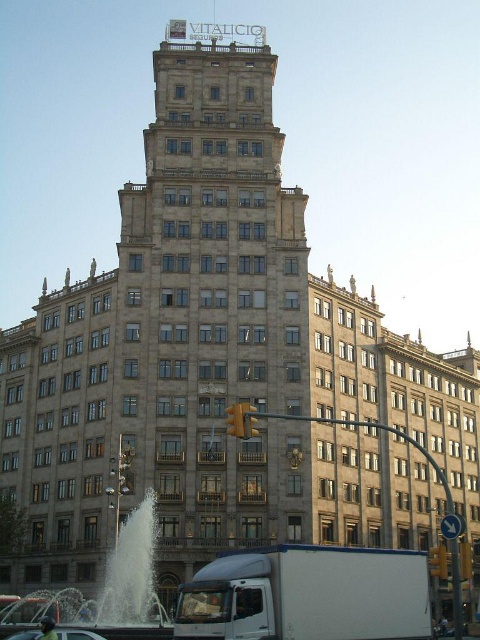
Question: Among these points, which one is nearest to the camera?

Choices:
 (A) (70, 636)
 (B) (160, 616)

Answer: (A)

Question: Which point is farther to the camera?

Choices:
 (A) (34, 637)
 (B) (128, 634)

Answer: (B)

Question: Which of the following is the closest to the observer?

Choices:
 (A) metallic silver car at lower center
 (B) white marble fountain at lower center

Answer: (A)

Question: Is white marble fountain at lower center closer to camera compared to metallic silver car at lower center?

Choices:
 (A) no
 (B) yes

Answer: (A)

Question: Does white marble fountain at lower center have a larger size compared to metallic silver car at lower center?

Choices:
 (A) yes
 (B) no

Answer: (A)

Question: Is white marble fountain at lower center further to the viewer compared to metallic silver car at lower center?

Choices:
 (A) yes
 (B) no

Answer: (A)